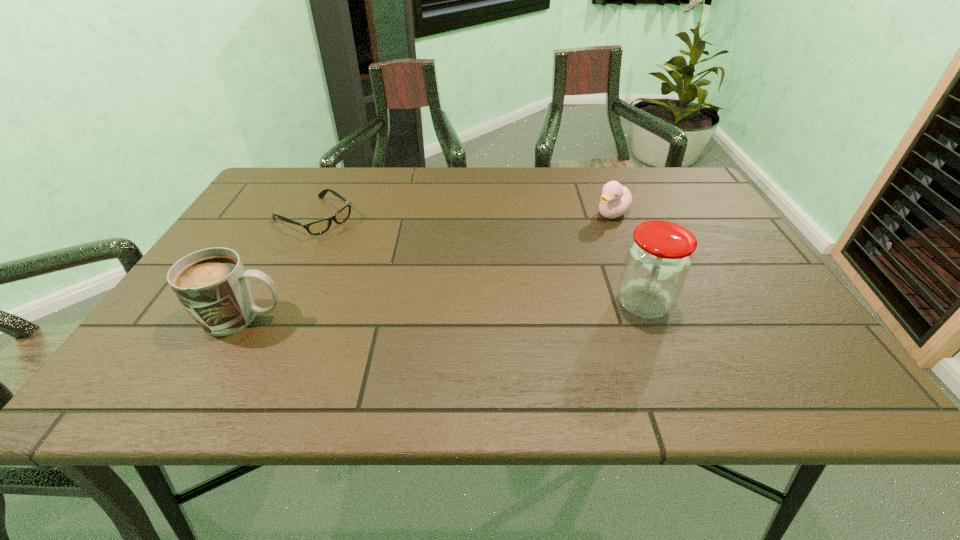
This screenshot has height=540, width=960. In the image, there is a desktop. What are the coordinates of `free region at the far edge` in the screenshot? It's located at (372, 192).

You are a GUI agent. You are given a task and a screenshot of the screen. Output one action in this format:
    pyautogui.click(x=<x>, y=<y>)
    Task: Click on the vacant space at the near edge of the desktop
    
    Given the screenshot: What is the action you would take?
    pyautogui.click(x=669, y=338)

This screenshot has height=540, width=960. I want to click on vacant region at the right edge of the desktop, so click(x=708, y=300).

You are a GUI agent. You are given a task and a screenshot of the screen. Output one action in this format:
    pyautogui.click(x=<x>, y=<y>)
    Task: Click on the free space at the far left corner of the desktop
    The width and height of the screenshot is (960, 540).
    Given the screenshot: What is the action you would take?
    pyautogui.click(x=280, y=173)

The height and width of the screenshot is (540, 960). Identify the location of vacant space at the far right corner. (705, 205).

In order to click on vacant area at the near right corner of the desktop in this screenshot , I will do `click(747, 333)`.

Find the location of a particular element. The image size is (960, 540). free space between the spectacles and the second tallest object is located at coordinates (278, 268).

At what (x,y) coordinates should I click in order to perform the action: click on vacant area that lies between the mug and the second shortest object. Please return your answer as a coordinate pair (x, y). Looking at the image, I should click on (427, 265).

Image resolution: width=960 pixels, height=540 pixels. What are the coordinates of `free space between the mug and the shortest object` in the screenshot? It's located at (278, 268).

At what (x,y) coordinates should I click in order to perform the action: click on vacant space in between the mug and the shortest object. Please return your answer as a coordinate pair (x, y). This screenshot has height=540, width=960. Looking at the image, I should click on (278, 268).